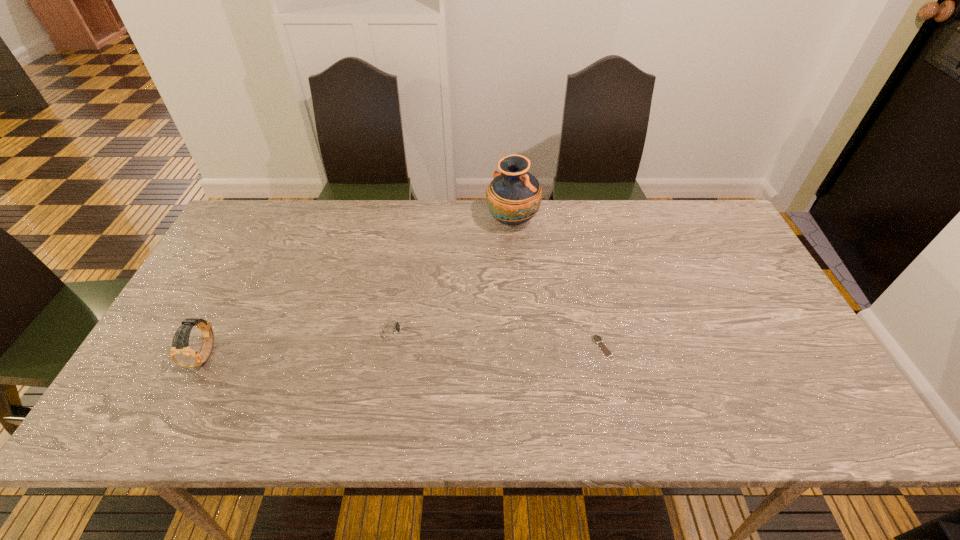
Locate an element on the screen. object that is the third closest one to the shortest watch is located at coordinates (181, 353).

Locate an element on the screen. object that is the closest to the shortest watch is located at coordinates (514, 196).

Select which watch appears as the second closest to the rightmost watch. Please provide its 2D coordinates. Your answer should be formatted as a tuple, i.e. [(x, y)], where the tuple contains the x and y coordinates of a point satisfying the conditions above.

[(181, 353)]

Select which watch is the closest to the leftmost object. Please provide its 2D coordinates. Your answer should be formatted as a tuple, i.e. [(x, y)], where the tuple contains the x and y coordinates of a point satisfying the conditions above.

[(390, 330)]

At what (x,y) coordinates should I click in order to perform the action: click on vacant space that satisfies the following two spatial constraints: 1. on the face of the second tallest watch; 2. on the face of the leftmost watch. Please return your answer as a coordinate pair (x, y). This screenshot has width=960, height=540. Looking at the image, I should click on (387, 354).

Locate an element on the screen. This screenshot has width=960, height=540. vacant space that satisfies the following two spatial constraints: 1. on the face of the shortest watch; 2. on the right side of the second shortest watch is located at coordinates (389, 348).

Where is `vacant space that satisfies the following two spatial constraints: 1. on the face of the second object from left to right; 2. on the face of the leftmost watch`? vacant space that satisfies the following two spatial constraints: 1. on the face of the second object from left to right; 2. on the face of the leftmost watch is located at coordinates (387, 354).

At what (x,y) coordinates should I click in order to perform the action: click on vacant area that satisfies the following two spatial constraints: 1. on the face of the second tallest watch; 2. on the face of the third shortest object. Please return your answer as a coordinate pair (x, y). Image resolution: width=960 pixels, height=540 pixels. Looking at the image, I should click on (387, 354).

Find the location of a particular element. This screenshot has width=960, height=540. free location that satisfies the following two spatial constraints: 1. on the face of the second shortest object; 2. on the face of the leftmost object is located at coordinates (387, 354).

Where is `vacant space that satisfies the following two spatial constraints: 1. on the face of the second object from left to right; 2. on the face of the leftmost object`? vacant space that satisfies the following two spatial constraints: 1. on the face of the second object from left to right; 2. on the face of the leftmost object is located at coordinates (387, 354).